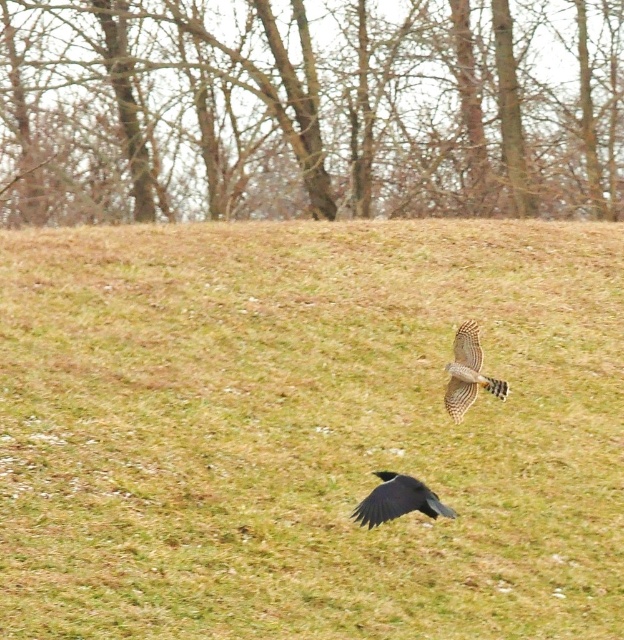
How far apart are black glossy bird at lower center and speckled brown eagle at center?

black glossy bird at lower center and speckled brown eagle at center are 4.61 feet apart from each other.

Between black glossy bird at lower center and speckled brown eagle at center, which one has more height?

speckled brown eagle at center

Does point (399, 509) lie in front of point (461, 328)?

Yes, it is in front of point (461, 328).

Where is `black glossy bird at lower center`? black glossy bird at lower center is located at coordinates (397, 500).

Does green grass at center appear on the left side of speckled brown eagle at center?

Indeed, green grass at center is positioned on the left side of speckled brown eagle at center.

Which is below, green grass at center or speckled brown eagle at center?

speckled brown eagle at center is lower down.

Who is more forward, (482, 500) or (464, 323)?

Point (482, 500) is more forward.

The image size is (624, 640). I want to click on green grass at center, so click(308, 429).

Is green grass at center in front of brown bark trees at upper center?

That is True.

Who is more distant from viewer, (263,337) or (524,145)?

The point (524,145) is behind.

What are the coordinates of `green grass at center` in the screenshot? It's located at (308, 429).